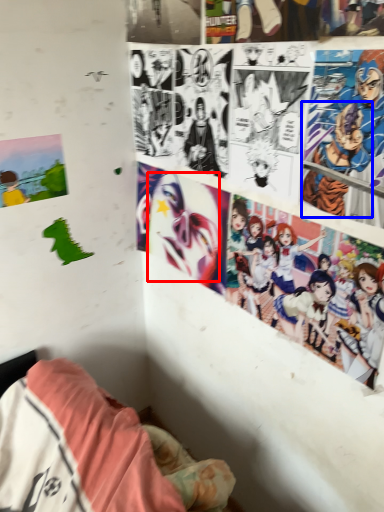
Question: Which point is closer to the camera, human face (highlighted by a red box) or person (highlighted by a blue box)?

Choices:
 (A) human face
 (B) person

Answer: (B)